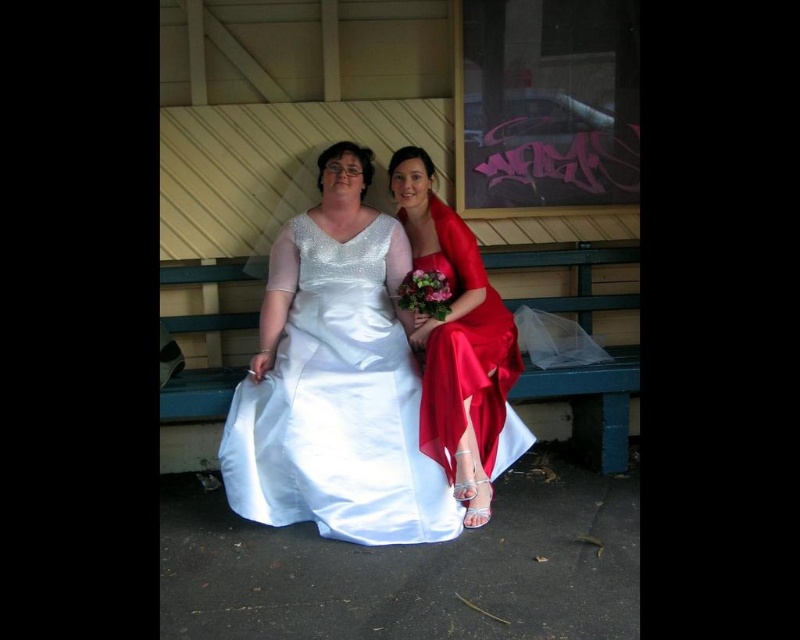
Where is the satin white dress at center located in the image?

The satin white dress at center is located at point 0.627 on the x axis and 0.422 on the y axis.